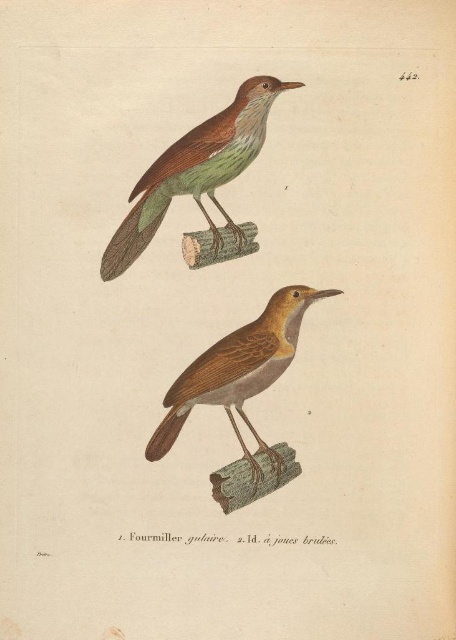
Consider the image. Between matte brown bird at upper center and brown matte bird at center, which one has more height?

brown matte bird at center is taller.

Who is positioned more to the left, matte brown bird at upper center or brown matte bird at center?

matte brown bird at upper center is more to the left.

What do you see at coordinates (196, 170) in the screenshot? I see `matte brown bird at upper center` at bounding box center [196, 170].

This screenshot has height=640, width=456. What are the coordinates of `matte brown bird at upper center` in the screenshot? It's located at (196, 170).